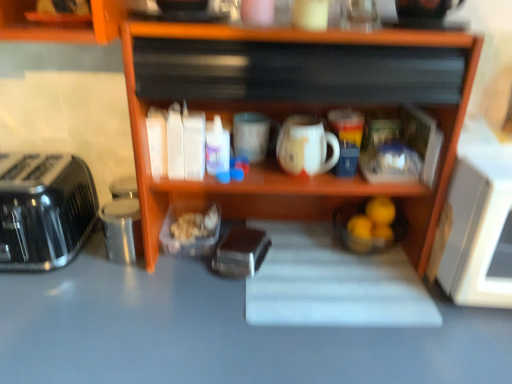
Question: From their relative heights in the image, would you say satin black toaster at left is taller or shorter than smooth gray countertop at center?

Choices:
 (A) short
 (B) tall

Answer: (A)

Question: In terms of size, does satin black toaster at left appear bigger or smaller than smooth gray countertop at center?

Choices:
 (A) big
 (B) small

Answer: (B)

Question: Estimate the real-world distances between objects in this image. Which object is closer to the metallic silver toaster at center?

Choices:
 (A) wooden shelf at center
 (B) smooth gray countertop at center
 (C) white matte mug at center
 (D) brushed metal toaster at left
 (E) white glossy mug at center

Answer: (C)

Question: Based on their relative distances, which object is farther from the wooden shelf at center?

Choices:
 (A) smooth gray countertop at center
 (B) brushed metal toaster at left
 (C) satin black toaster at left
 (D) white matte mug at center
 (E) white glossy mug at center

Answer: (C)